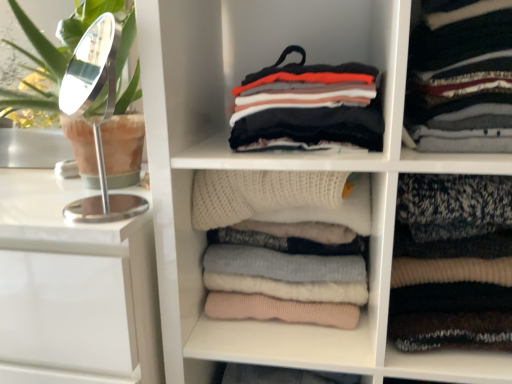
Question: Can white knitted sweater at center be found inside knitted wool sweater at right, the 1th clothing in the right-to-left sequence?

Choices:
 (A) yes
 (B) no

Answer: (B)

Question: Does knitted wool sweater at right, which is counted as the third clothing, starting from the left, have a greater width compared to white knitted sweater at center?

Choices:
 (A) yes
 (B) no

Answer: (A)

Question: Is knitted wool sweater at right, the 1th clothing in the right-to-left sequence, located outside white knitted sweater at center?

Choices:
 (A) no
 (B) yes

Answer: (B)

Question: Does knitted wool sweater at right, which is counted as the third clothing, starting from the left, appear on the right side of white knitted sweater at center?

Choices:
 (A) yes
 (B) no

Answer: (A)

Question: Are knitted wool sweater at right, the 1th clothing in the right-to-left sequence, and white knitted sweater at center located far from each other?

Choices:
 (A) yes
 (B) no

Answer: (B)

Question: In terms of size, does knit sweater at center appear bigger or smaller than knitted wool sweater at right, the 1th clothing in the right-to-left sequence?

Choices:
 (A) small
 (B) big

Answer: (B)

Question: Is knit sweater at center spatially inside knitted wool sweater at right, which is counted as the third clothing, starting from the left, or outside of it?

Choices:
 (A) inside
 (B) outside

Answer: (B)

Question: Relative to knitted wool sweater at right, the 1th clothing in the right-to-left sequence, is knit sweater at center in front or behind?

Choices:
 (A) behind
 (B) front

Answer: (B)

Question: From the image's perspective, is knit sweater at center located above or below knitted wool sweater at right, which is counted as the third clothing, starting from the left?

Choices:
 (A) below
 (B) above

Answer: (A)

Question: Is knit sweater at center taller or shorter than multicolored knitted sweater at center, positioned as the first clothing in left-to-right order?

Choices:
 (A) tall
 (B) short

Answer: (A)

Question: Is knit sweater at center wider or thinner than multicolored knitted sweater at center, positioned as the first clothing in left-to-right order?

Choices:
 (A) thin
 (B) wide

Answer: (B)

Question: Considering the positions of point (352, 339) and point (302, 129), is point (352, 339) closer or farther from the camera than point (302, 129)?

Choices:
 (A) farther
 (B) closer

Answer: (A)

Question: Choose the correct answer: Is knit sweater at center inside multicolored knitted sweater at center, positioned as the first clothing in left-to-right order, or outside it?

Choices:
 (A) inside
 (B) outside

Answer: (B)

Question: Do you think striped knit sweater at upper right, which appears as the second clothing when viewed from the right, is within white knitted sweater at center, or outside of it?

Choices:
 (A) inside
 (B) outside

Answer: (B)

Question: Considering their positions, is striped knit sweater at upper right, which is the 2th clothing from left to right, located in front of or behind white knitted sweater at center?

Choices:
 (A) behind
 (B) front

Answer: (B)